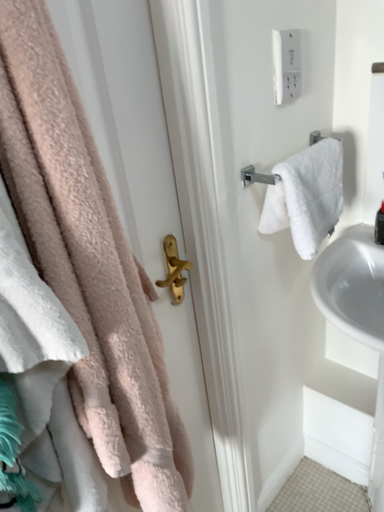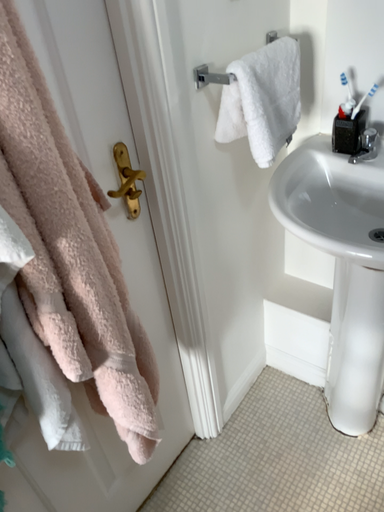
Question: How did the camera likely rotate when shooting the video?

Choices:
 (A) rotated upward
 (B) rotated downward

Answer: (B)